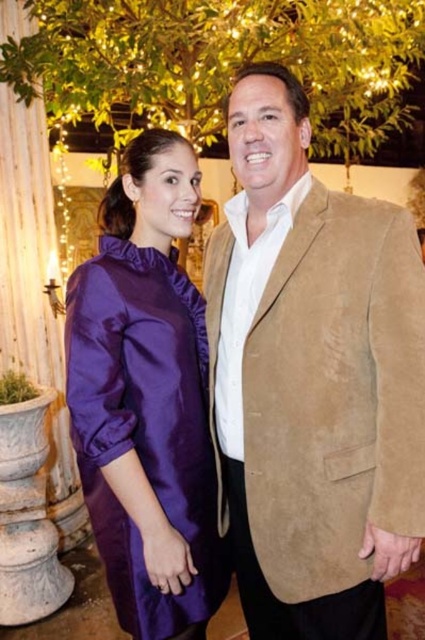
Question: Is suede jacket at center further to the viewer compared to purple satin dress at center?

Choices:
 (A) no
 (B) yes

Answer: (A)

Question: In this image, where is suede jacket at center located relative to purple satin dress at center?

Choices:
 (A) left
 (B) right

Answer: (B)

Question: From the image, what is the correct spatial relationship of suede jacket at center in relation to purple satin dress at center?

Choices:
 (A) left
 (B) right

Answer: (B)

Question: Which point is farther to the camera?

Choices:
 (A) [227, 248]
 (B) [115, 298]

Answer: (A)

Question: Which object appears closest to the camera in this image?

Choices:
 (A) purple satin dress at center
 (B) suede jacket at center

Answer: (B)